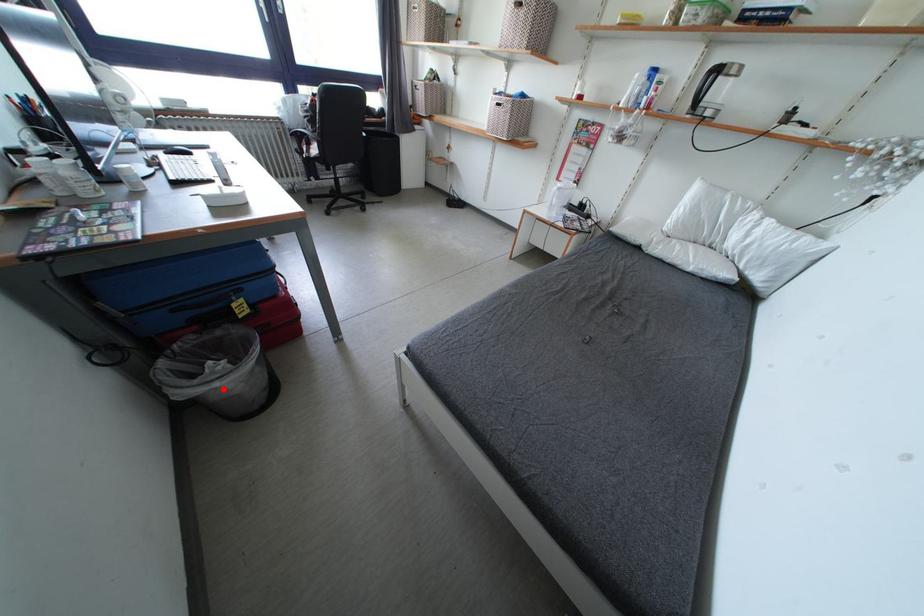
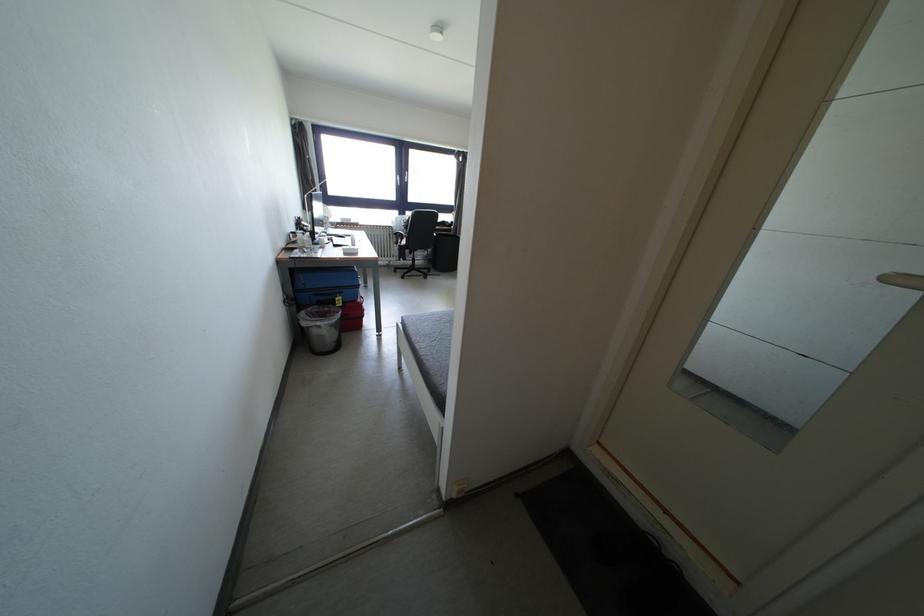
In the second image, find the point that corresponds to the highlighted location in the first image.

(324, 328)